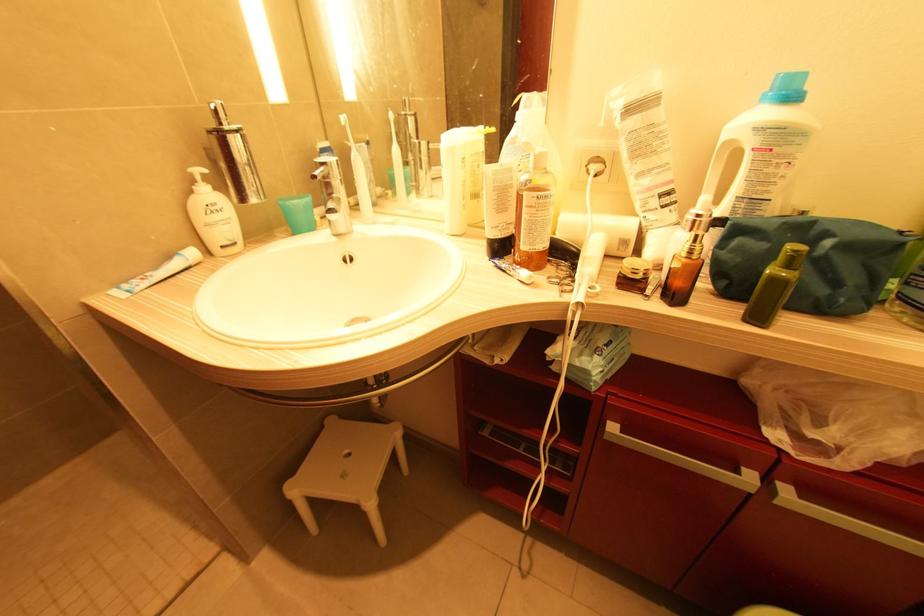
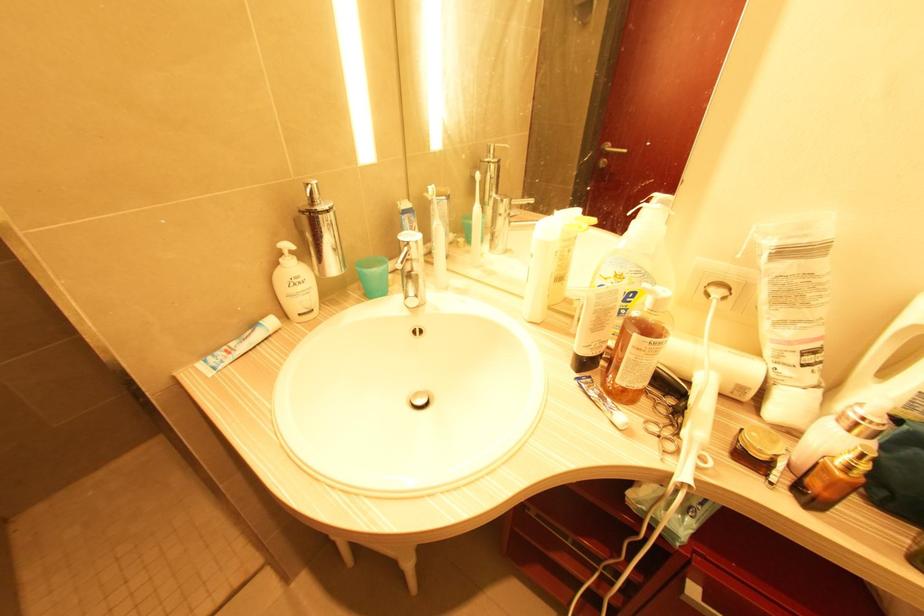
Find the pixel in the second image that matches point (192, 192) in the first image.

(280, 265)